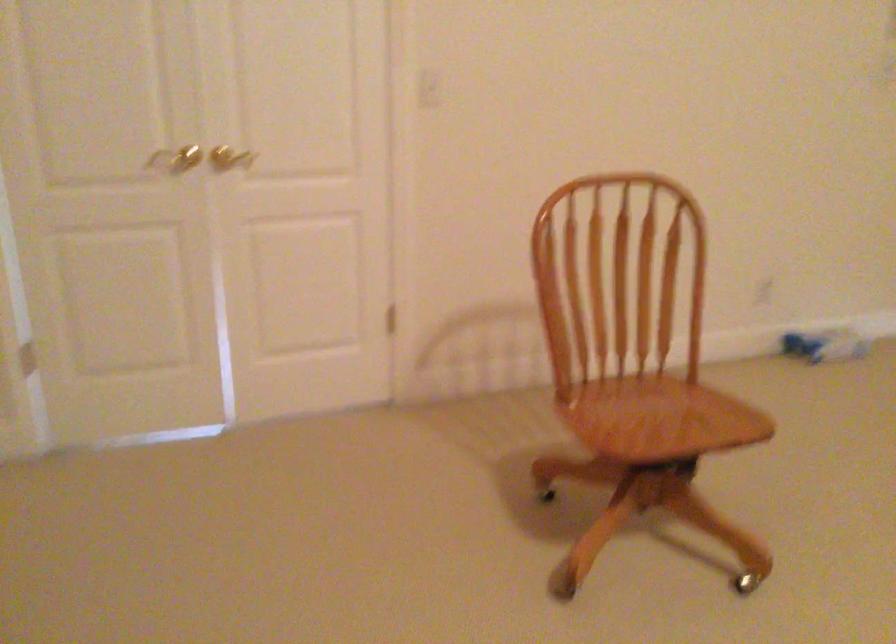
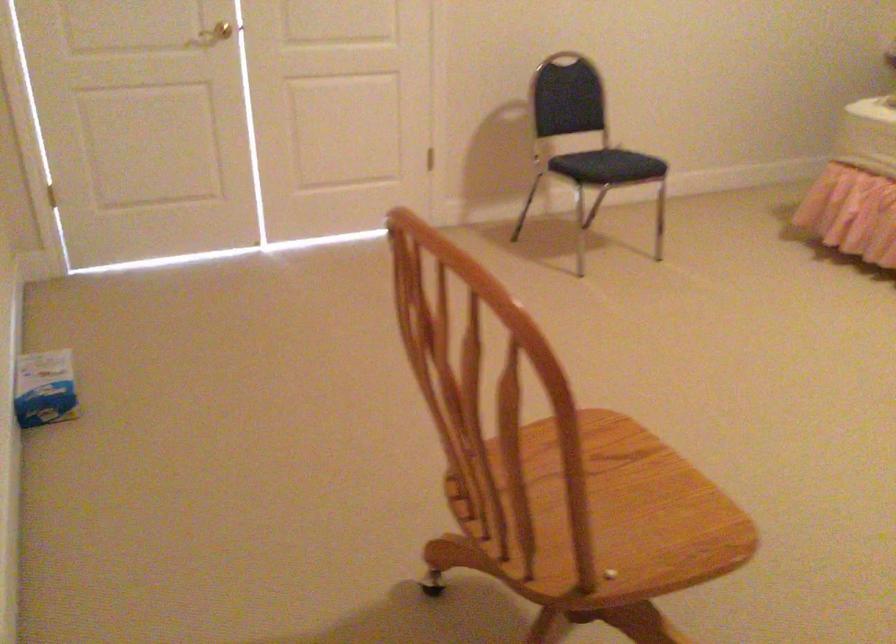
In the second image, find the point that corresponds to point 794,322 in the first image.

(45, 388)